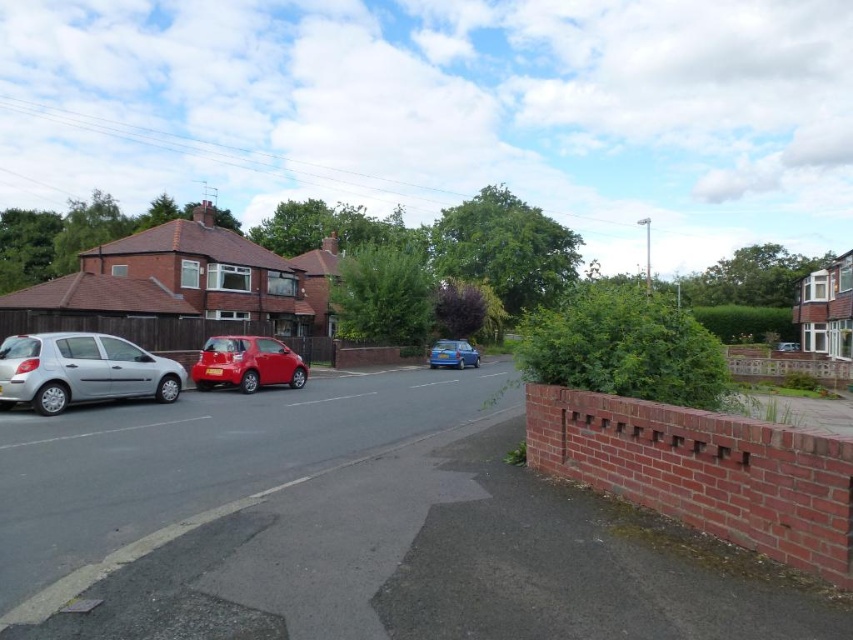
You are a pedestrian standing on the sidewalk next to the road. You see the shiny red car at center and the blue metallic hatchback at center. Which car is closer to the brick wall on the right side of the road?

The shiny red car at center is closer to the brick wall on the right side of the road because it is positioned to the left of the blue metallic hatchback at center, and since both are on the left side of the road, the red car being further left would be closer to the center of the road, but the brick wall is on the right side. Wait, this seems conflicting. Let me recheck the scene description. The scene says the two parked cars are on the left side of the road. The brick wall is on the right side. So, the 2

You are a delivery person trying to park your van between the shiny red car at center and the metallic silver car at center on the left side of the road. Your van is 2 meters wide. Can you fit your van between them?

The shiny red car at center is narrower than the metallic silver car at center. However, the distance between the two cars isn not provided in the objects description, so we cannot determine if the van will fit.

You are standing at the point with coordinates point (451, 365) and want to walk to the point with coordinates point (202, 349). Which direction should you face to walk directly towards your destination?

You should face north because point (202, 349) is in front of point (451, 365).